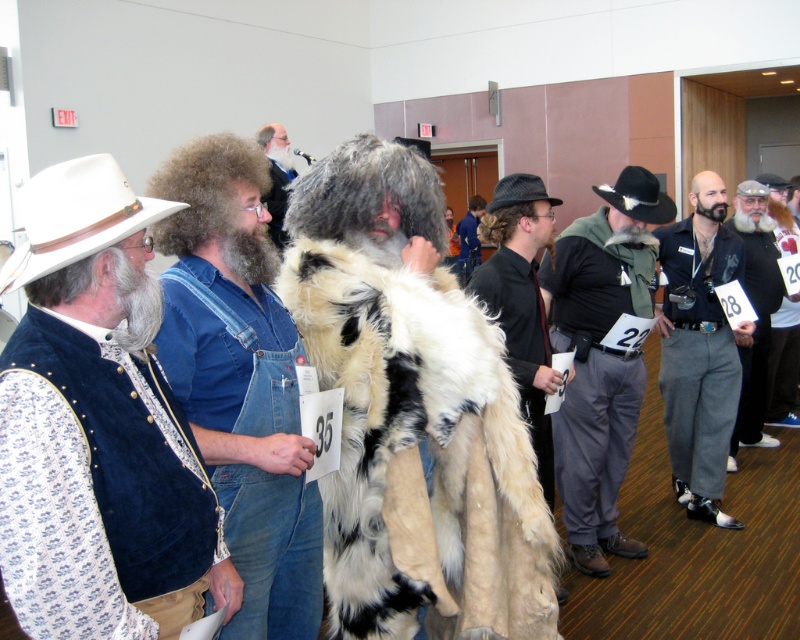
You are organizing a photo shoot and need to arrange participants so that the white fur coat at center and the fluffy fur coat at center can both be visible in the frame. Given their sizes, which coat should be placed closer to the camera to ensure both are fully visible?

The white fur coat at center is wider than the fluffy fur coat at center, so to ensure both are fully visible in the frame, the wider white fur coat at center should be placed closer to the camera. This way, its larger size won

You are organizing a photo shoot and need to arrange the gray woolen coat at center and the gray felt cowboy hat at upper right in a way that the coat appears taller than the hat. Given their actual sizes, is this arrangement possible?

The gray woolen coat at center has a greater height compared to gray felt cowboy hat at upper right, so arranging them in this manner is feasible as the coat naturally stands taller than the hat.